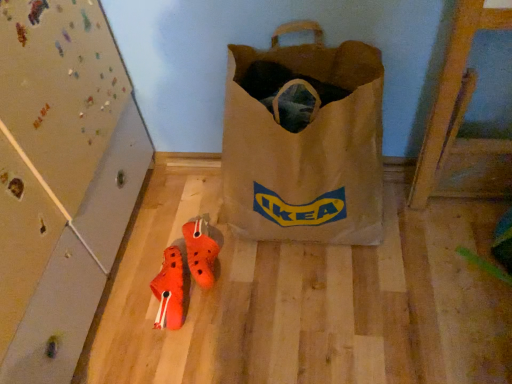
Question: Is orange matte sneakers at lower center, placed as the second footwear when sorted from right to left, not near brown paper bag at center?

Choices:
 (A) no
 (B) yes

Answer: (A)

Question: Considering the relative sizes of orange matte sneakers at lower center, placed as the second footwear when sorted from right to left, and brown paper bag at center in the image provided, is orange matte sneakers at lower center, placed as the second footwear when sorted from right to left, taller than brown paper bag at center?

Choices:
 (A) no
 (B) yes

Answer: (A)

Question: From the image's perspective, is orange matte sneakers at lower center, arranged as the first footwear when viewed from the left, located above brown paper bag at center?

Choices:
 (A) no
 (B) yes

Answer: (A)

Question: From a real-world perspective, is orange matte sneakers at lower center, placed as the second footwear when sorted from right to left, physically above brown paper bag at center?

Choices:
 (A) no
 (B) yes

Answer: (A)

Question: Considering the relative sizes of orange matte sneakers at lower center, placed as the second footwear when sorted from right to left, and brown paper bag at center in the image provided, is orange matte sneakers at lower center, placed as the second footwear when sorted from right to left, smaller than brown paper bag at center?

Choices:
 (A) yes
 (B) no

Answer: (A)

Question: Does point (246, 192) appear closer or farther from the camera than point (197, 241)?

Choices:
 (A) closer
 (B) farther

Answer: (A)

Question: Based on their sizes in the image, would you say brown paper bag at center is bigger or smaller than orange rubber clogs at center, the 2th footwear from the left?

Choices:
 (A) small
 (B) big

Answer: (B)

Question: Visually, is brown paper bag at center positioned to the left or to the right of orange rubber clogs at center, the 2th footwear from the left?

Choices:
 (A) right
 (B) left

Answer: (A)

Question: Is brown paper bag at center wider or thinner than orange rubber clogs at center, the 1th footwear viewed from the right?

Choices:
 (A) thin
 (B) wide

Answer: (B)

Question: Looking at their shapes, would you say orange rubber clogs at center, the 2th footwear from the left, is wider or thinner than brown paper bag at center?

Choices:
 (A) thin
 (B) wide

Answer: (A)

Question: In terms of height, does orange rubber clogs at center, the 2th footwear from the left, look taller or shorter compared to brown paper bag at center?

Choices:
 (A) tall
 (B) short

Answer: (B)

Question: From the image's perspective, is orange rubber clogs at center, the 1th footwear viewed from the right, positioned above or below brown paper bag at center?

Choices:
 (A) above
 (B) below

Answer: (B)

Question: From a real-world perspective, is orange rubber clogs at center, the 2th footwear from the left, above or below brown paper bag at center?

Choices:
 (A) above
 (B) below

Answer: (B)

Question: From a real-world perspective, relative to brown paper bag at center, is orange matte sneakers at lower center, placed as the second footwear when sorted from right to left, vertically above or below?

Choices:
 (A) below
 (B) above

Answer: (A)

Question: Is point (174, 327) closer or farther from the camera than point (374, 236)?

Choices:
 (A) farther
 (B) closer

Answer: (B)